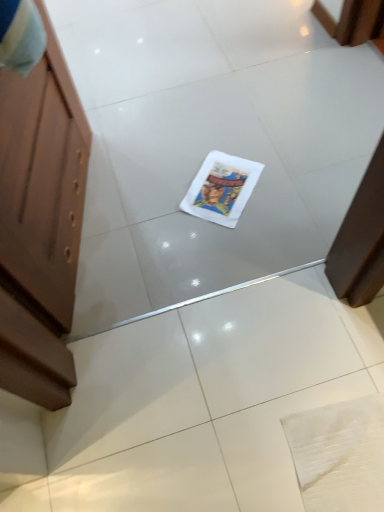
Locate an element on the screen. This screenshot has height=512, width=384. vacant region below white paper comic book at center (from a real-world perspective) is located at coordinates (229, 188).